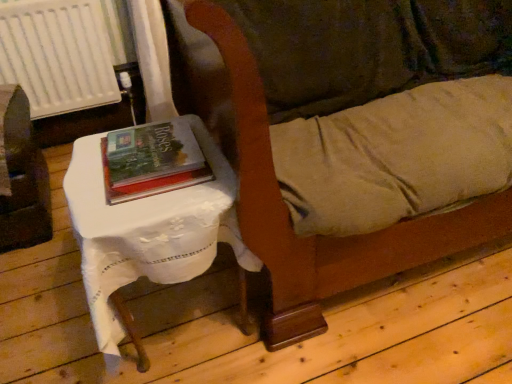
This screenshot has width=512, height=384. Identify the location of free space in front of hardcover book at center. (143, 210).